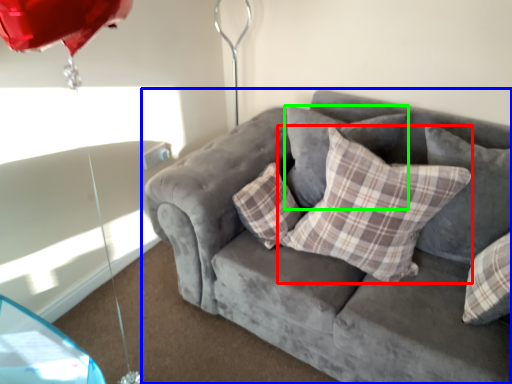
Question: Which object is the closest to the pillow (highlighted by a red box)? Choose among these: studio couch (highlighted by a blue box) or pillow (highlighted by a green box).

Choices:
 (A) studio couch
 (B) pillow

Answer: (A)